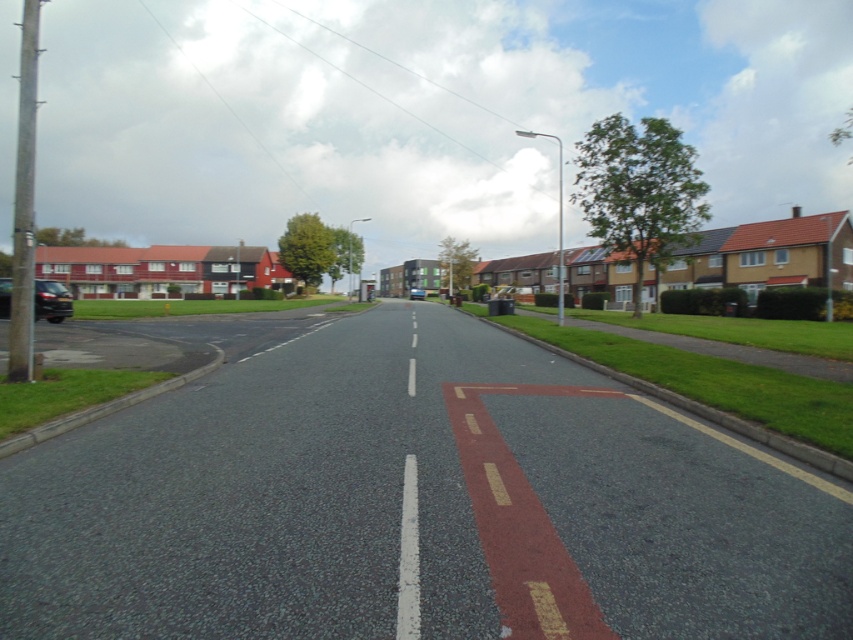
You are a pedestrian standing on the sidewalk and want to cross the road to the park on the other side. There are two cars on the road, a shiny black car at left and a matte black car at center. Based on their positions, which car is closer to the curb on the right side of the road?

The shiny black car at left is below matte black car at center, so the shiny black car at left is closer to the curb on the right side of the road.

You are driving a shiny black car at left and want to park it in a garage that can only accommodate vehicles up to the height of the matte black car at center. Will your car fit?

The shiny black car at left is much taller than the matte black car at center, so it will not fit in the garage.

You are a delivery drone flying above a suburban street. You need to navigate between two points marked as point (55, 321) and point (425, 292). According to the scene, which point is closer to the starting position of the drone?

Point (55, 321) is in front of point (425, 292), so the drone should first reach point (55, 321) before moving to point (425, 292).